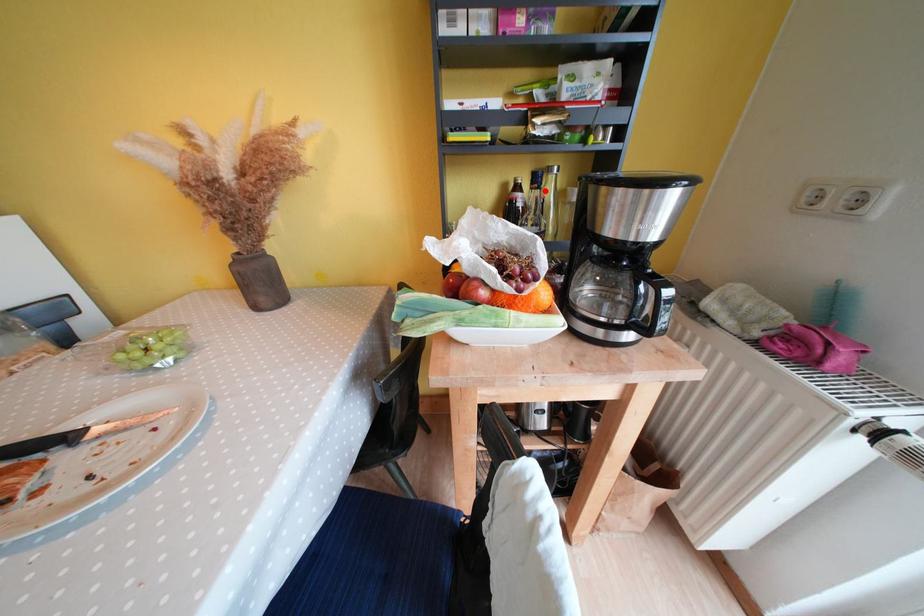
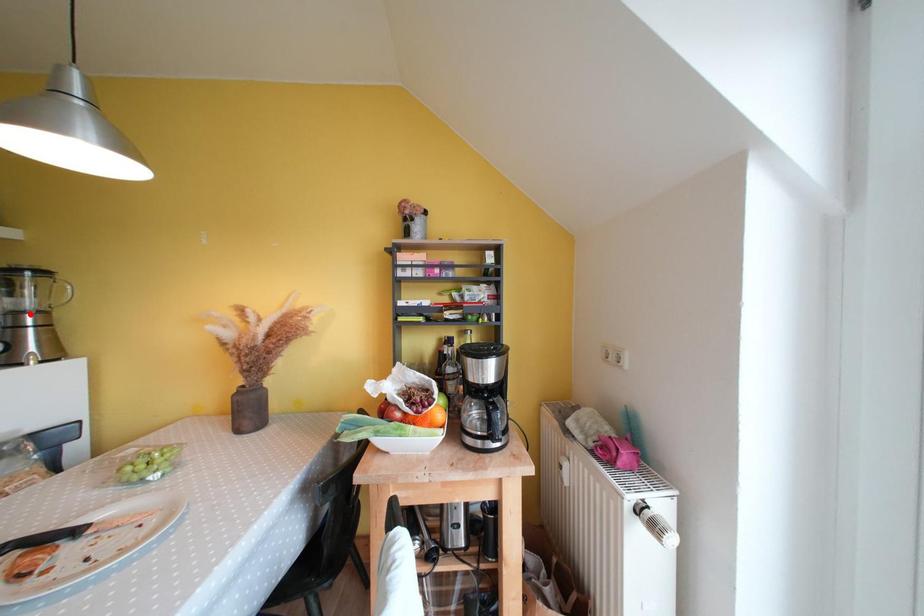
I am providing you with two images of the same scene from different viewpoints. A red point is marked on the first image and another point is marked on the second image. Does the point marked in image1 correspond to the same location as the one in image2?

No